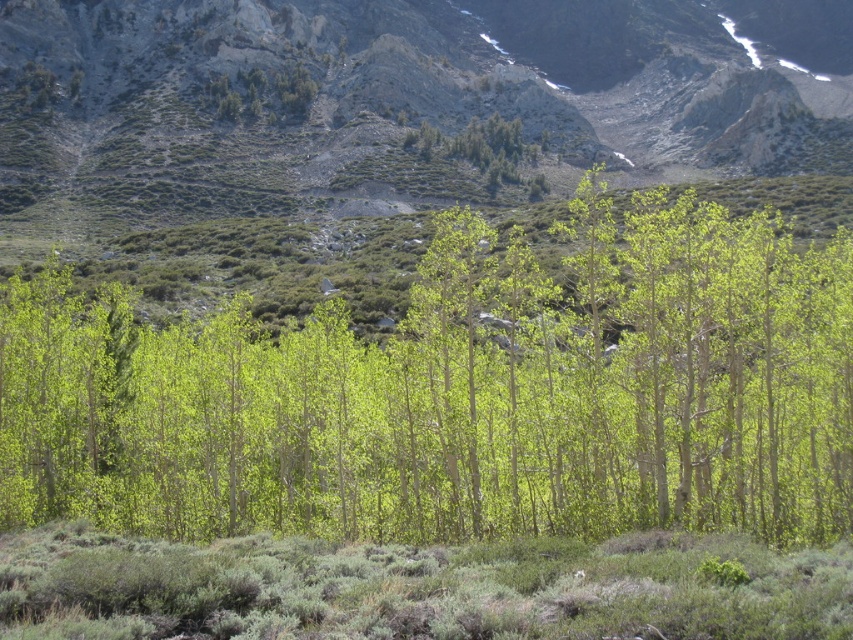
Based on the photo, does green leafy trees at center have a lesser height compared to green leafy tree at upper center?

In fact, green leafy trees at center may be taller than green leafy tree at upper center.

Is point (59, 4) positioned after point (311, 90)?

That is True.

Where is `green leafy trees at center`? green leafy trees at center is located at coordinates (405, 100).

Based on the photo, is green matte trees at center shorter than green leafy tree at upper center?

No, green matte trees at center is not shorter than green leafy tree at upper center.

Between point (86, 428) and point (267, 84), which one is positioned in front?

Positioned in front is point (86, 428).

Who is more distant from viewer, [229,349] or [308,81]?

Point [308,81]

The width and height of the screenshot is (853, 640). I want to click on green matte trees at center, so click(459, 394).

Can you confirm if green matte trees at center is smaller than green leafy trees at center?

Indeed, green matte trees at center has a smaller size compared to green leafy trees at center.

Where is `green matte trees at center`? Image resolution: width=853 pixels, height=640 pixels. green matte trees at center is located at coordinates (459, 394).

You are a GUI agent. You are given a task and a screenshot of the screen. Output one action in this format:
    pyautogui.click(x=<x>, y=<y>)
    Task: Click on the green matte trees at center
    This screenshot has width=853, height=640.
    Given the screenshot: What is the action you would take?
    pyautogui.click(x=459, y=394)